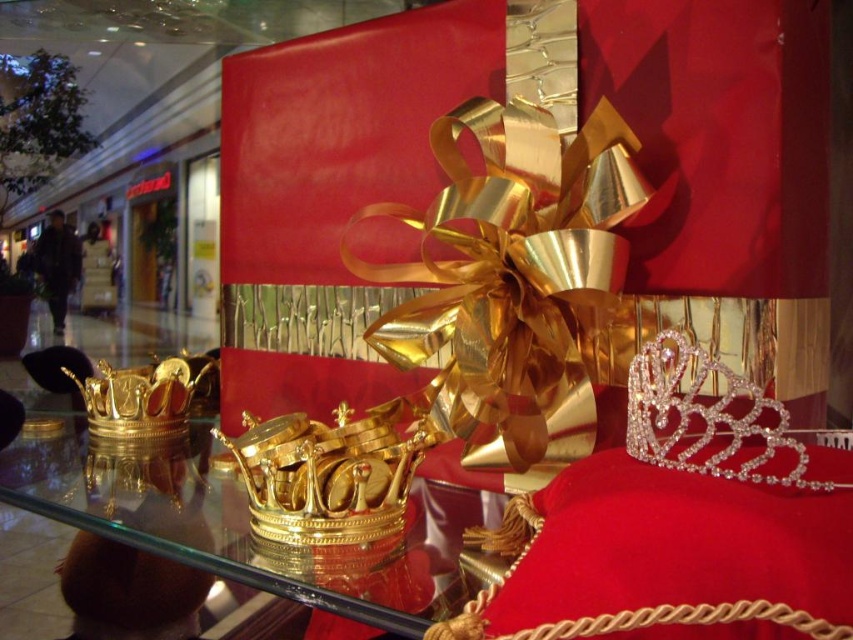
You are a store employee arranging items on a display shelf. You have a transparent glass crown at center and a gold shiny crown at center. If you want to place both crowns side by side on a shelf that is 1 meter wide, will they fit without overlapping?

The transparent glass crown at center might be wider than gold shiny crown at center. Therefore, it is uncertain if both will fit without overlapping since their combined widths could exceed the shelf width.

You are a store employee who needs to place a 12 inch wide decorative box between the gold shiny crown at center and the gold shiny crown at left. Based on the display setup, will the box fit between them?

The distance between the gold shiny crown at center and the gold shiny crown at left is 14.76 inches. Since the decorative box is 12 inches wide, there is enough space to fit it between them.